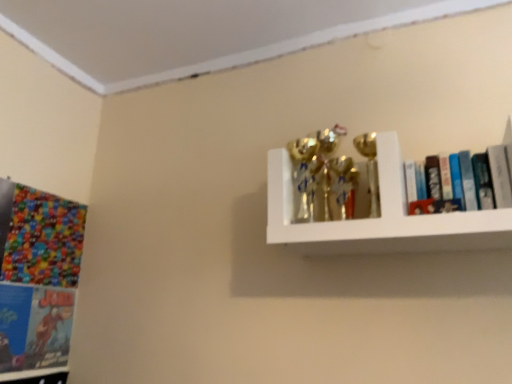
Question: Is hardcover books at upper right, the 1th book when ordered from front to back, thinner than multicolored glossy comic book at left?

Choices:
 (A) yes
 (B) no

Answer: (B)

Question: Does hardcover books at upper right, which appears as the 2th book when viewed from the back, have a greater height compared to multicolored glossy comic book at left?

Choices:
 (A) yes
 (B) no

Answer: (B)

Question: Does hardcover books at upper right, which is the first book in top-to-bottom order, come in front of multicolored glossy comic book at left?

Choices:
 (A) yes
 (B) no

Answer: (A)

Question: From the image's perspective, does hardcover books at upper right, which is the first book in top-to-bottom order, appear higher than multicolored glossy comic book at left?

Choices:
 (A) yes
 (B) no

Answer: (A)

Question: Would you say hardcover books at upper right, arranged as the first book when viewed from the right, contains multicolored glossy comic book at left?

Choices:
 (A) no
 (B) yes

Answer: (A)

Question: Considering the relative positions of hardcover books at upper right, the 1th book when ordered from front to back, and multicolored glossy comic book at left in the image provided, is hardcover books at upper right, the 1th book when ordered from front to back, to the right of multicolored glossy comic book at left from the viewer's perspective?

Choices:
 (A) no
 (B) yes

Answer: (B)

Question: Is matte blue book at lower left, placed as the second book when sorted from front to back, thinner than multicolored glossy comic book at left?

Choices:
 (A) yes
 (B) no

Answer: (A)

Question: Does matte blue book at lower left, placed as the 1th book when sorted from back to front, appear on the left side of multicolored glossy comic book at left?

Choices:
 (A) yes
 (B) no

Answer: (A)

Question: Would you consider matte blue book at lower left, placed as the 1th book when sorted from back to front, to be distant from multicolored glossy comic book at left?

Choices:
 (A) no
 (B) yes

Answer: (A)

Question: Could you tell me if matte blue book at lower left, which is the second book from right to left, is turned towards multicolored glossy comic book at left?

Choices:
 (A) no
 (B) yes

Answer: (A)

Question: Considering the relative sizes of matte blue book at lower left, acting as the 2th book starting from the top, and multicolored glossy comic book at left in the image provided, is matte blue book at lower left, acting as the 2th book starting from the top, shorter than multicolored glossy comic book at left?

Choices:
 (A) yes
 (B) no

Answer: (A)

Question: From the image's perspective, is matte blue book at lower left, which is the second book from right to left, on multicolored glossy comic book at left?

Choices:
 (A) yes
 (B) no

Answer: (B)

Question: Can you confirm if hardcover books at upper right, arranged as the first book when viewed from the right, is shorter than white glossy shelf at upper right?

Choices:
 (A) no
 (B) yes

Answer: (B)